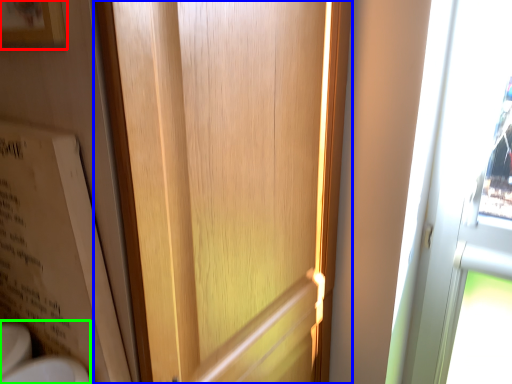
Question: Estimate the real-world distances between objects in this image. Which object is farther from picture frame (highlighted by a red box), door (highlighted by a blue box) or sink (highlighted by a green box)?

Choices:
 (A) door
 (B) sink

Answer: (B)